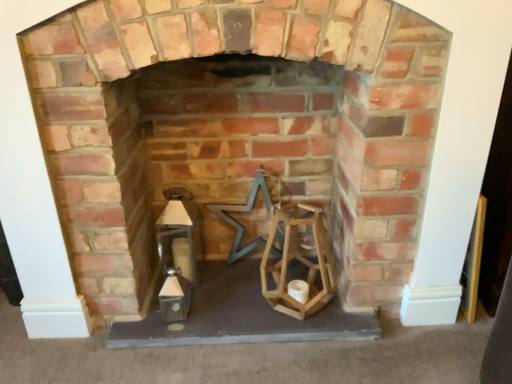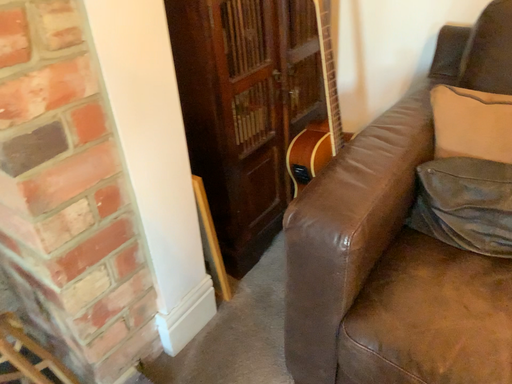
Question: How did the camera likely rotate when shooting the video?

Choices:
 (A) rotated right
 (B) rotated left

Answer: (A)